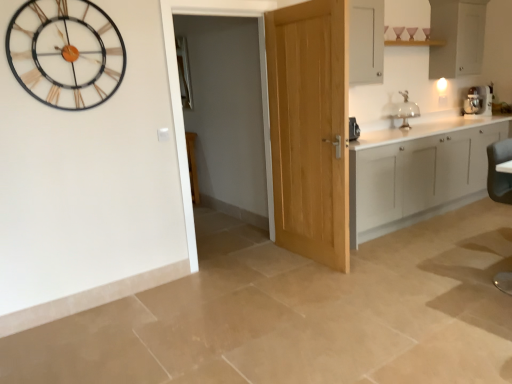
Question: From a real-world perspective, is white matte cabinetry at right, marked as the second cabinetry in a top-to-bottom arrangement, physically below metallic gold and black wall clock at upper left?

Choices:
 (A) yes
 (B) no

Answer: (A)

Question: From the image's perspective, is white matte cabinetry at right, the 1th cabinetry ordered from the bottom, located beneath metallic gold and black wall clock at upper left?

Choices:
 (A) yes
 (B) no

Answer: (A)

Question: Could you tell me if white matte cabinetry at right, the 1th cabinetry ordered from the bottom, is turned towards metallic gold and black wall clock at upper left?

Choices:
 (A) yes
 (B) no

Answer: (B)

Question: Does white matte cabinetry at right, marked as the second cabinetry in a top-to-bottom arrangement, have a greater height compared to metallic gold and black wall clock at upper left?

Choices:
 (A) yes
 (B) no

Answer: (A)

Question: Is the surface of white matte cabinetry at right, marked as the second cabinetry in a top-to-bottom arrangement, in direct contact with metallic gold and black wall clock at upper left?

Choices:
 (A) yes
 (B) no

Answer: (B)

Question: Is black leather swivel chair at lower right taller or shorter than white matte cabinet at upper right, which ranks as the first cabinetry in top-to-bottom order?

Choices:
 (A) short
 (B) tall

Answer: (B)

Question: Considering their positions, is black leather swivel chair at lower right located in front of or behind white matte cabinet at upper right, which ranks as the 2th cabinetry in bottom-to-top order?

Choices:
 (A) front
 (B) behind

Answer: (A)

Question: In the image, is black leather swivel chair at lower right on the left side or the right side of white matte cabinet at upper right, which ranks as the first cabinetry in top-to-bottom order?

Choices:
 (A) left
 (B) right

Answer: (A)

Question: Looking at the image, does black leather swivel chair at lower right seem bigger or smaller compared to white matte cabinet at upper right, which ranks as the first cabinetry in top-to-bottom order?

Choices:
 (A) small
 (B) big

Answer: (A)

Question: Visually, is light oak door at center positioned to the left or to the right of white matte cabinetry at right, the 1th cabinetry ordered from the bottom?

Choices:
 (A) right
 (B) left

Answer: (B)

Question: Looking at the image, does light oak door at center seem bigger or smaller compared to white matte cabinetry at right, the 1th cabinetry ordered from the bottom?

Choices:
 (A) small
 (B) big

Answer: (A)

Question: Is point (295, 208) closer or farther from the camera than point (351, 180)?

Choices:
 (A) farther
 (B) closer

Answer: (A)

Question: From the image's perspective, is light oak door at center positioned above or below white matte cabinetry at right, the 1th cabinetry ordered from the bottom?

Choices:
 (A) below
 (B) above

Answer: (B)

Question: Would you say white matte cabinet at upper right, which ranks as the 2th cabinetry in bottom-to-top order, is inside or outside black leather swivel chair at lower right?

Choices:
 (A) outside
 (B) inside

Answer: (A)

Question: Looking at the image, does white matte cabinet at upper right, which ranks as the 2th cabinetry in bottom-to-top order, seem bigger or smaller compared to black leather swivel chair at lower right?

Choices:
 (A) big
 (B) small

Answer: (A)